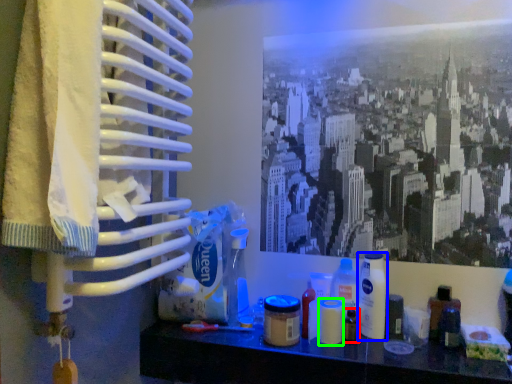
Question: Which object is positioned farthest from toiletry (highlighted by a red box)? Select from bottle (highlighted by a blue box) and toiletry (highlighted by a green box).

Choices:
 (A) bottle
 (B) toiletry

Answer: (A)